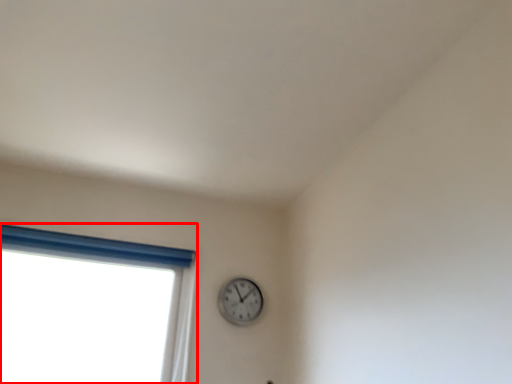
Question: From the image's perspective, where is window (annotated by the red box) located relative to wall clock?

Choices:
 (A) below
 (B) above

Answer: (A)